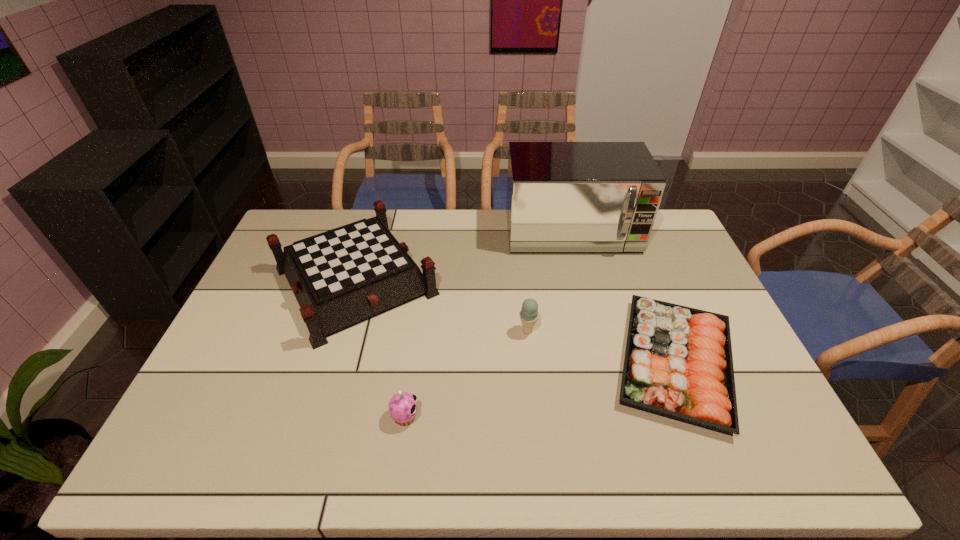
The height and width of the screenshot is (540, 960). Find the location of `unoccupied position between the microwave oven and the cupcake`. unoccupied position between the microwave oven and the cupcake is located at coordinates (489, 325).

The height and width of the screenshot is (540, 960). Find the location of `vacant space that's between the platter and the ice cream`. vacant space that's between the platter and the ice cream is located at coordinates (601, 347).

The image size is (960, 540). I want to click on free point between the checkerboard and the cupcake, so click(x=380, y=349).

Locate an element on the screen. This screenshot has width=960, height=540. blank region between the microwave oven and the checkerboard is located at coordinates (464, 257).

At what (x,y) coordinates should I click in order to perform the action: click on unoccupied area between the cupcake and the ice cream. Please return your answer as a coordinate pair (x, y). The height and width of the screenshot is (540, 960). Looking at the image, I should click on (467, 374).

The height and width of the screenshot is (540, 960). Find the location of `object that is the second nearest to the checkerboard`. object that is the second nearest to the checkerboard is located at coordinates click(x=561, y=196).

Identify which object is the nearest to the platter. Please provide its 2D coordinates. Your answer should be formatted as a tuple, i.e. [(x, y)], where the tuple contains the x and y coordinates of a point satisfying the conditions above.

[(529, 315)]

You are a GUI agent. You are given a task and a screenshot of the screen. Output one action in this format:
    pyautogui.click(x=<x>, y=<y>)
    Task: Click on the vacant region that satisfies the following two spatial constraints: 1. on the front side of the ice cream; 2. on the right side of the checkerboard
    The height and width of the screenshot is (540, 960).
    Given the screenshot: What is the action you would take?
    pyautogui.click(x=341, y=331)

Locate an element on the screen. The height and width of the screenshot is (540, 960). vacant area that satisfies the following two spatial constraints: 1. with the door open on the shortest object; 2. on the left side of the tallest object is located at coordinates (604, 362).